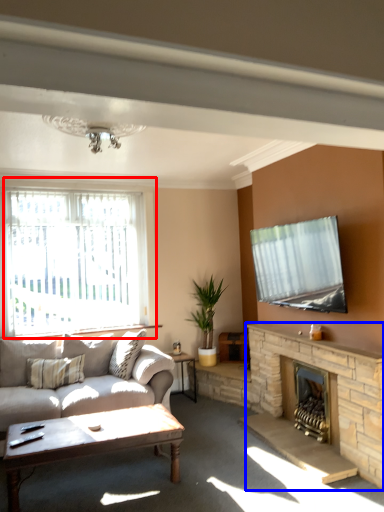
Question: Among these objects, which one is farthest to the camera, window (highlighted by a red box) or fireplace (highlighted by a blue box)?

Choices:
 (A) window
 (B) fireplace

Answer: (A)